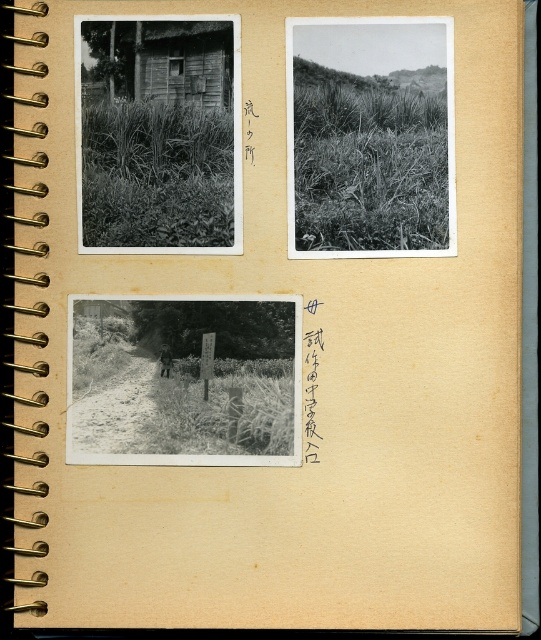
Is grassy field at upper right further to the viewer compared to grassy vegetation at upper left?

No, it is in front of grassy vegetation at upper left.

Does point (300, 195) come farther from viewer compared to point (159, 172)?

Yes, it is.

Who is more distant from viewer, (395,134) or (154,243)?

The point (154,243) is more distant.

Locate an element on the screen. This screenshot has width=541, height=640. grassy field at upper right is located at coordinates (367, 163).

Between grassy field at upper right and wooden hut at upper left, which one is positioned higher?

wooden hut at upper left is higher up.

What do you see at coordinates (367, 163) in the screenshot?
I see `grassy field at upper right` at bounding box center [367, 163].

Find the location of a particular element. This screenshot has height=640, width=541. grassy field at upper right is located at coordinates (367, 163).

Who is positioned more to the right, grassy vegetation at upper left or wooden hut at upper left?

Positioned to the right is wooden hut at upper left.

Is point (159, 141) in front of point (118, 45)?

No, (159, 141) is further to viewer.

Which is behind, point (187, 221) or point (174, 51)?

The point (187, 221) is more distant.

Find the location of a particular element. The image size is (541, 640). grassy vegetation at upper left is located at coordinates (156, 176).